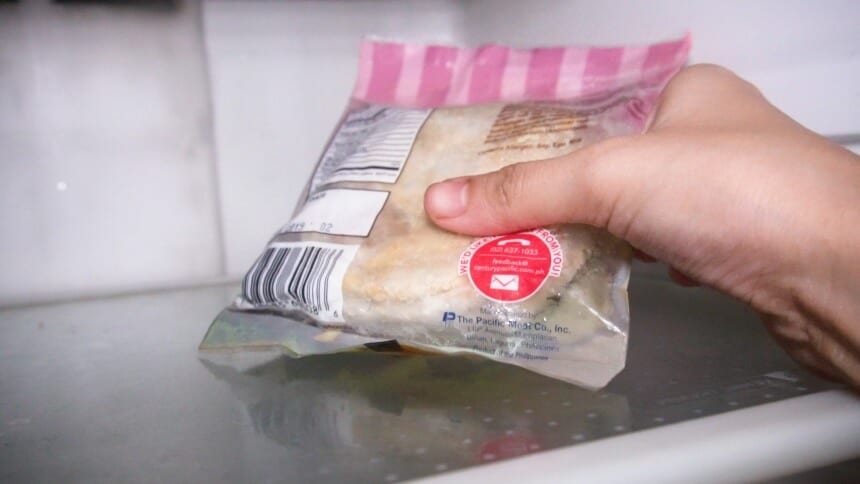
Identify the location of stainless steel counter. The height and width of the screenshot is (484, 860). (114, 408).